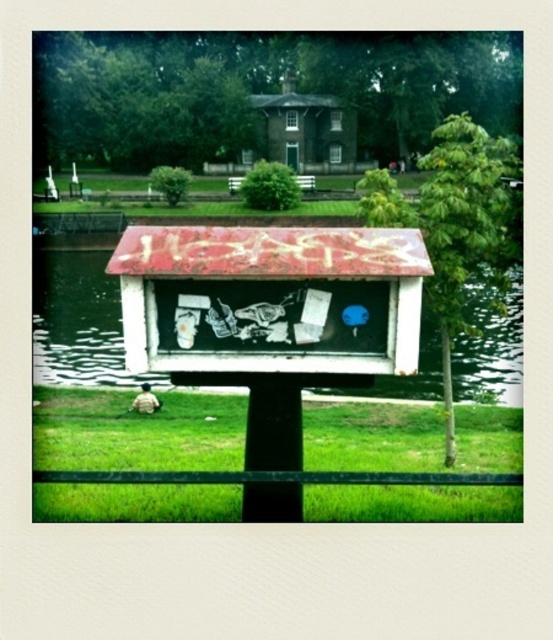
Question: Is green grass at lower center closer to camera compared to dark green wooden hut at center?

Choices:
 (A) yes
 (B) no

Answer: (A)

Question: From the image, what is the correct spatial relationship of green grass at lower center in relation to dark green wooden hut at center?

Choices:
 (A) below
 (B) above

Answer: (A)

Question: Does green grass at lower center appear on the right side of dark green wooden hut at center?

Choices:
 (A) yes
 (B) no

Answer: (A)

Question: Among these objects, which one is farthest from the camera?

Choices:
 (A) smooth water at center
 (B) green grass at lower center
 (C) dark green wooden hut at center

Answer: (C)

Question: Which point is closer to the camera?

Choices:
 (A) smooth water at center
 (B) green grass at lower center
 (C) dark green wooden hut at center

Answer: (B)

Question: Which object is positioned closest to the smooth water at center?

Choices:
 (A) green grass at lower center
 (B) dark green wooden hut at center

Answer: (A)